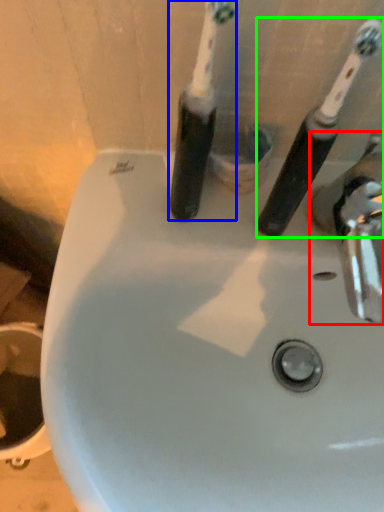
Question: Estimate the real-world distances between objects in this image. Which object is farther from tap (highlighted by a red box), toothbrush (highlighted by a blue box) or toothbrush (highlighted by a green box)?

Choices:
 (A) toothbrush
 (B) toothbrush

Answer: (A)